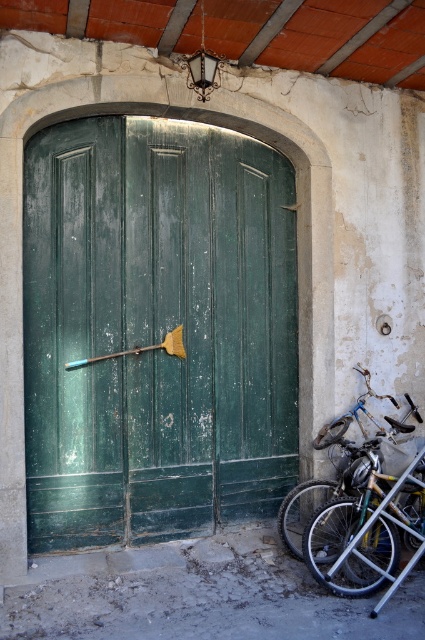
Question: Among these points, which one is nearest to the camera?

Choices:
 (A) (416, 416)
 (B) (311, 572)

Answer: (B)

Question: Can you confirm if green wooden door at center is bigger than shiny silver bicycle at lower right?

Choices:
 (A) no
 (B) yes

Answer: (B)

Question: Which point is closer to the camera?

Choices:
 (A) (368, 412)
 (B) (359, 593)

Answer: (B)

Question: Does shiny silver bicycle at lower right have a smaller size compared to blue metallic bicycle at lower right?

Choices:
 (A) no
 (B) yes

Answer: (A)

Question: Where is shiny silver bicycle at lower right located in relation to blue metallic bicycle at lower right in the image?

Choices:
 (A) left
 (B) right

Answer: (A)

Question: Which object is the closest to the blue metallic bicycle at lower right?

Choices:
 (A) shiny silver bicycle at lower right
 (B) green wooden door at center

Answer: (A)